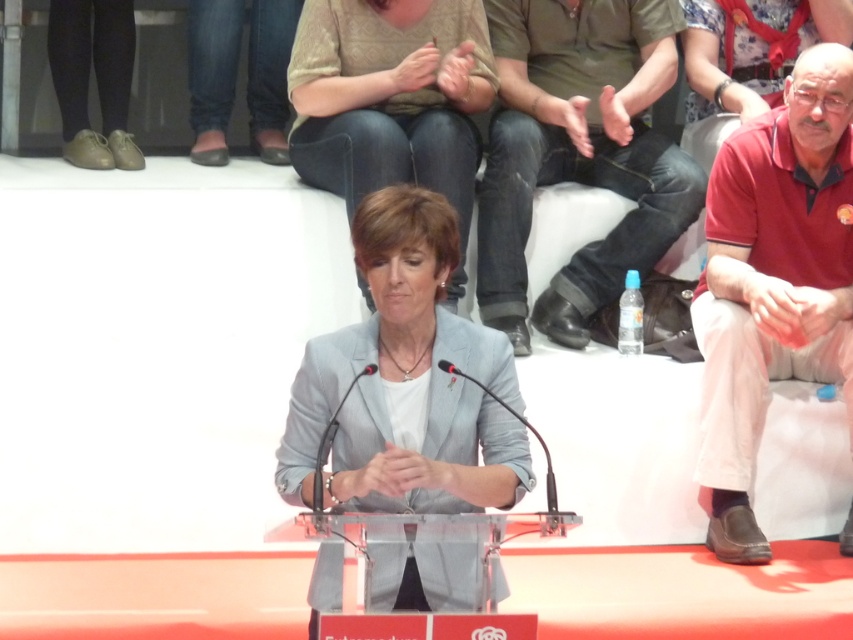
Does light gray fabric jacket at center appear under red cotton shirt at right?

Correct, light gray fabric jacket at center is located below red cotton shirt at right.

Does point (465, 483) come closer to viewer compared to point (763, 540)?

Yes, it is in front of point (763, 540).

Where is `light gray fabric jacket at center`? This screenshot has width=853, height=640. light gray fabric jacket at center is located at coordinates (405, 381).

From the picture: Between matte beige sweater at upper center and matte gray blazer at center, which one is positioned lower?

matte beige sweater at upper center is below.

What do you see at coordinates (390, 99) in the screenshot? The width and height of the screenshot is (853, 640). I see `matte beige sweater at upper center` at bounding box center [390, 99].

At what (x,y) coordinates should I click in order to perform the action: click on matte beige sweater at upper center. Please return your answer as a coordinate pair (x, y). Looking at the image, I should click on (390, 99).

Which of these two, matte leather shoes at lower left or matte gray blazer at center, stands shorter?

matte gray blazer at center is shorter.

Which is above, matte leather shoes at lower left or matte gray blazer at center?

matte gray blazer at center

Between point (113, 86) and point (763, 38), which one is positioned in front?

Point (763, 38) is more forward.

Where is `matte leather shoes at lower left`? The width and height of the screenshot is (853, 640). matte leather shoes at lower left is located at coordinates (x=96, y=77).